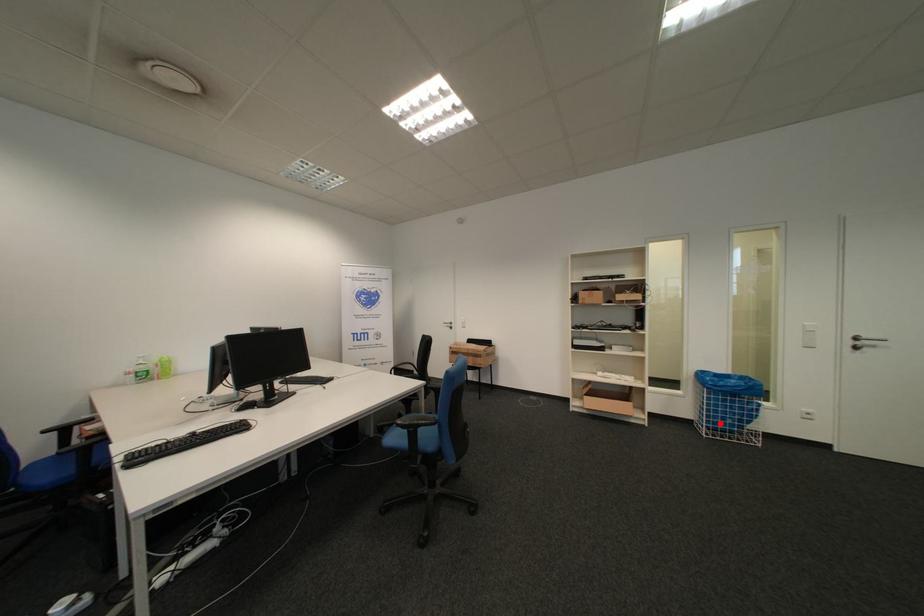
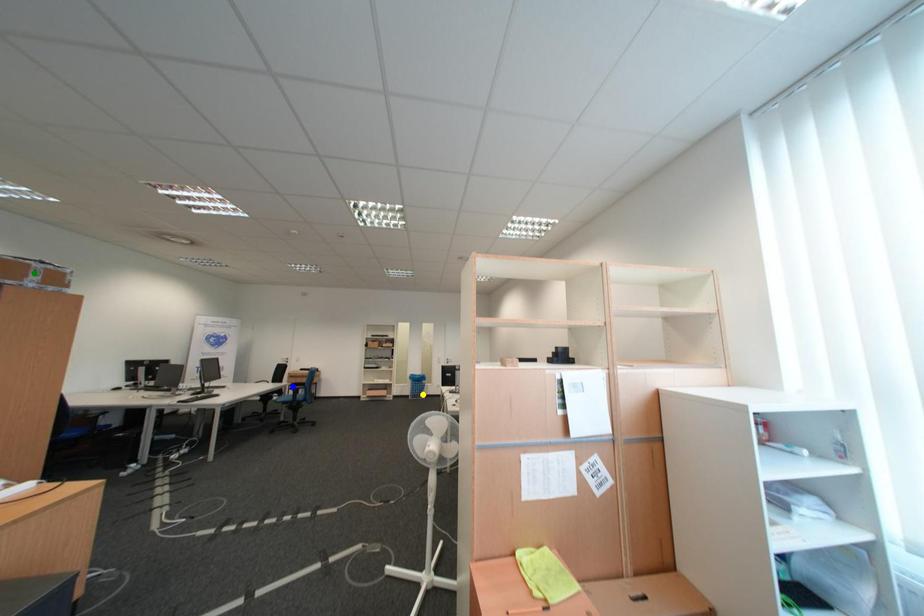
Question: I am providing you with two images of the same scene from different viewpoints. A red point is marked on the first image. You are given multiple points on the second image. Which spot in image 2 lines up with the point in image 1?

Choices:
 (A) yellow point
 (B) green point
 (C) blue point

Answer: (A)